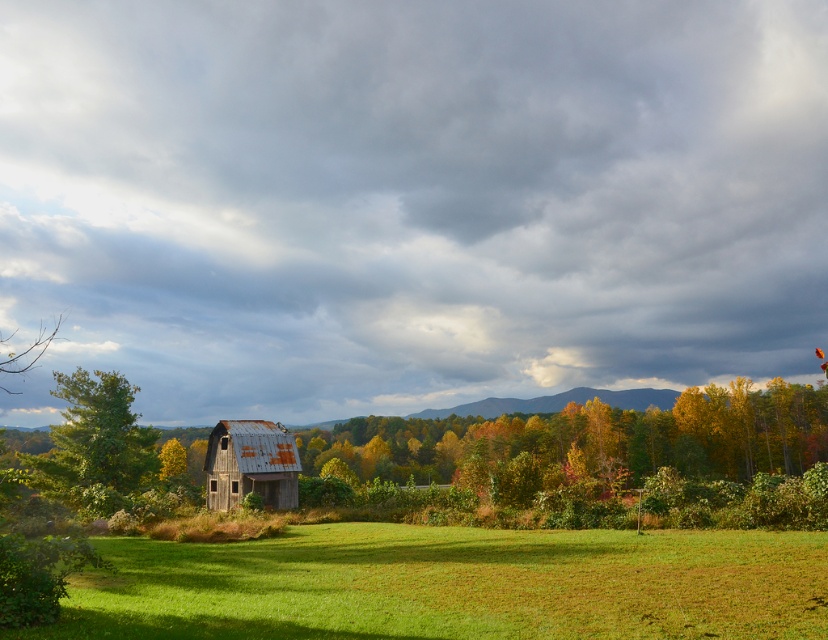
In the scene shown: You are a farmer planning to paint both the rusty metal barn at left and the rusty metal barn at center. You have enough paint to cover 100 square meters. Which barn requires more paint based on their widths?

The rusty metal barn at left requires more paint because its width is greater than the rusty metal barn at center, so it has a larger surface area to cover.

You are standing in the middle of the field in the image and want to walk directly towards the rusty metal barn at left. In which general direction should you head?

The rusty metal barn at left is located at point (597, 461) in the image. Since you are in the middle of the field, you should head towards the left and slightly upwards to reach the barn.